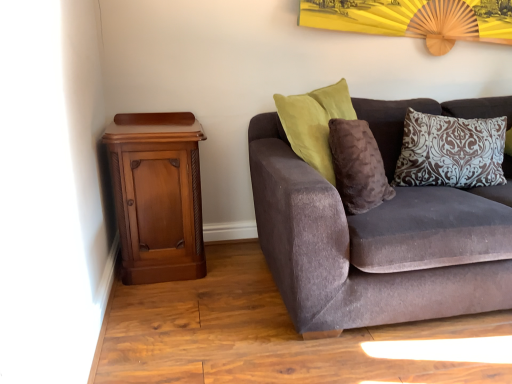
Question: From the image's perspective, relative to velvet brown couch at right, is brown damask pillow at upper right above or below?

Choices:
 (A) below
 (B) above

Answer: (B)

Question: Relative to velvet brown couch at right, is brown damask pillow at upper right in front or behind?

Choices:
 (A) behind
 (B) front

Answer: (A)

Question: Estimate the real-world distances between objects in this image. Which object is farther from the velvet brown couch at right?

Choices:
 (A) brown damask pillow at upper right
 (B) polished wood nightstand at left

Answer: (B)

Question: Estimate the real-world distances between objects in this image. Which object is farther from the brown damask pillow at upper right?

Choices:
 (A) polished wood nightstand at left
 (B) velvet brown couch at right

Answer: (A)